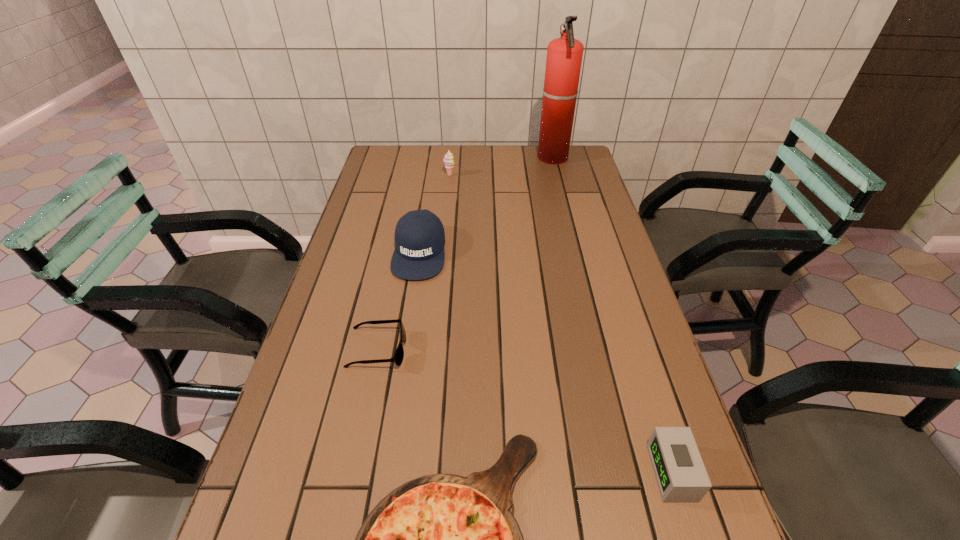
At what (x,y) coordinates should I click in order to perform the action: click on blank area located on the back of the sherbert. Please return your answer as a coordinate pair (x, y). Looking at the image, I should click on (452, 152).

The height and width of the screenshot is (540, 960). Find the location of `free point located on the front-facing side of the alarm clock`. free point located on the front-facing side of the alarm clock is located at coordinates (627, 472).

Identify the location of vacant space situated 0.130m on the front-facing side of the alarm clock. (585, 472).

Where is `free region located 0.080m on the front-facing side of the alarm clock`? The height and width of the screenshot is (540, 960). free region located 0.080m on the front-facing side of the alarm clock is located at coordinates (612, 472).

Locate an element on the screen. This screenshot has height=540, width=960. vacant space located 0.240m on the front-facing side of the sunglasses is located at coordinates (508, 350).

You are a GUI agent. You are given a task and a screenshot of the screen. Output one action in this format:
    pyautogui.click(x=<x>, y=<y>)
    Task: Click on the fire extinguisher that is at the far edge
    The height and width of the screenshot is (540, 960).
    Given the screenshot: What is the action you would take?
    pyautogui.click(x=564, y=55)

This screenshot has width=960, height=540. What are the coordinates of `sherbert that is at the far edge` in the screenshot? It's located at (448, 160).

This screenshot has height=540, width=960. I want to click on baseball cap that is at the left edge, so point(419,253).

Image resolution: width=960 pixels, height=540 pixels. What are the coordinates of `sunglasses situated at the left edge` in the screenshot? It's located at (399, 354).

At what (x,y) coordinates should I click in order to perform the action: click on fire extinguisher that is at the right edge. Please return your answer as a coordinate pair (x, y). This screenshot has height=540, width=960. Looking at the image, I should click on (564, 55).